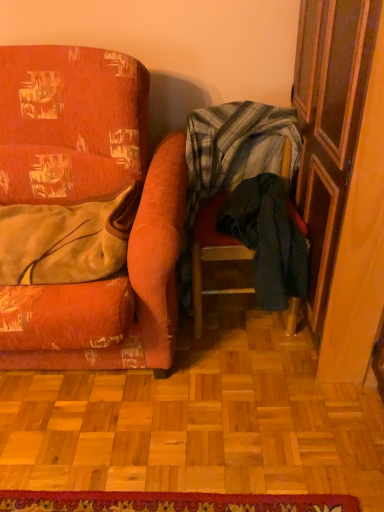
Question: Can you confirm if distressed orange fabric chair at left, the second chair from the right, is positioned to the left of wooden screen door at right?

Choices:
 (A) yes
 (B) no

Answer: (A)

Question: Does distressed orange fabric chair at left, the second chair from the right, have a greater height compared to wooden screen door at right?

Choices:
 (A) no
 (B) yes

Answer: (A)

Question: Is distressed orange fabric chair at left, the second chair from the right, positioned beyond the bounds of wooden screen door at right?

Choices:
 (A) yes
 (B) no

Answer: (A)

Question: Would you say distressed orange fabric chair at left, the second chair from the right, contains wooden screen door at right?

Choices:
 (A) yes
 (B) no

Answer: (B)

Question: Could you tell me if distressed orange fabric chair at left, the first chair viewed from the left, is turned towards wooden screen door at right?

Choices:
 (A) yes
 (B) no

Answer: (B)

Question: From the image's perspective, is plaid fabric chair at center, acting as the 1th chair starting from the right, located above or below wooden screen door at right?

Choices:
 (A) below
 (B) above

Answer: (A)

Question: Choose the correct answer: Is plaid fabric chair at center, the second chair from the left, inside wooden screen door at right or outside it?

Choices:
 (A) outside
 (B) inside

Answer: (A)

Question: From a real-world perspective, relative to wooden screen door at right, is plaid fabric chair at center, acting as the 1th chair starting from the right, vertically above or below?

Choices:
 (A) above
 (B) below

Answer: (B)

Question: Would you say plaid fabric chair at center, the second chair from the left, is to the left or to the right of wooden screen door at right in the picture?

Choices:
 (A) right
 (B) left

Answer: (B)

Question: From their relative heights in the image, would you say wooden screen door at right is taller or shorter than plaid fabric chair at center, acting as the 1th chair starting from the right?

Choices:
 (A) short
 (B) tall

Answer: (B)

Question: From the image's perspective, relative to plaid fabric chair at center, the second chair from the left, is wooden screen door at right above or below?

Choices:
 (A) above
 (B) below

Answer: (A)

Question: From a real-world perspective, is wooden screen door at right physically located above or below plaid fabric chair at center, the second chair from the left?

Choices:
 (A) below
 (B) above

Answer: (B)

Question: Based on their sizes in the image, would you say wooden screen door at right is bigger or smaller than plaid fabric chair at center, the second chair from the left?

Choices:
 (A) big
 (B) small

Answer: (A)

Question: Is distressed orange fabric chair at left, the second chair from the right, spatially inside wooden screen door at right, or outside of it?

Choices:
 (A) inside
 (B) outside

Answer: (B)

Question: From the image's perspective, is distressed orange fabric chair at left, the second chair from the right, above or below wooden screen door at right?

Choices:
 (A) below
 (B) above

Answer: (A)